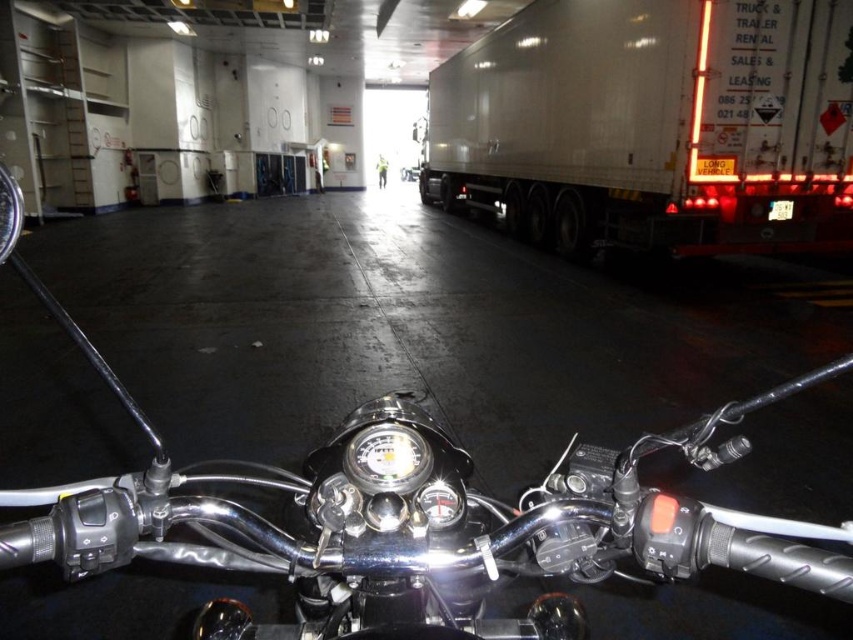
Is white glossy trailer truck at right smaller than metallic silver headlight at center?

No.

Who is more distant from viewer, (x=556, y=140) or (x=372, y=458)?

Positioned behind is point (x=556, y=140).

Is point (527, 205) farther from viewer compared to point (358, 480)?

Yes, point (527, 205) is behind point (358, 480).

Locate an element on the screen. The height and width of the screenshot is (640, 853). white glossy trailer truck at right is located at coordinates (653, 125).

Does point (683, 552) come closer to viewer compared to point (488, 132)?

That is True.

Does polished chrome motorcycle at center have a greater height compared to white glossy trailer truck at right?

In fact, polished chrome motorcycle at center may be shorter than white glossy trailer truck at right.

Where is `polished chrome motorcycle at center`? Image resolution: width=853 pixels, height=640 pixels. polished chrome motorcycle at center is located at coordinates (415, 522).

Describe the element at coordinates (415, 522) in the screenshot. I see `polished chrome motorcycle at center` at that location.

Does point (7, 186) come closer to viewer compared to point (393, 428)?

Yes, point (7, 186) is in front of point (393, 428).

Is point (381, 614) less distant than point (405, 472)?

Yes, point (381, 614) is in front of point (405, 472).

This screenshot has width=853, height=640. What are the coordinates of `polished chrome motorcycle at center` in the screenshot? It's located at (415, 522).